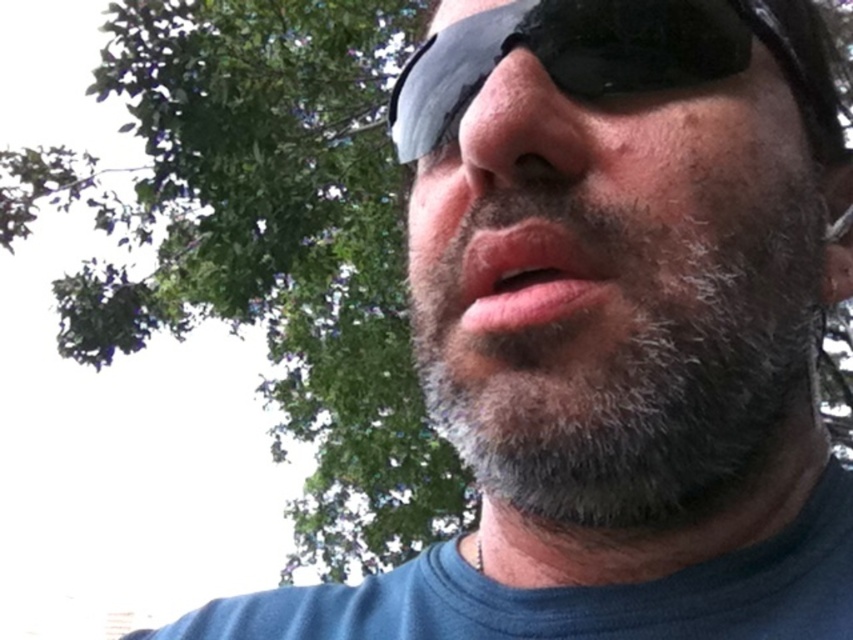
Is gray fuzzy beard at center to the right of dry matte nose at center from the viewer's perspective?

Indeed, gray fuzzy beard at center is positioned on the right side of dry matte nose at center.

Measure the distance between point (747, 477) and camera.

The distance of point (747, 477) from camera is 19.16 inches.

Find the location of `gray fuzzy beard at center`. gray fuzzy beard at center is located at coordinates (618, 349).

Can you confirm if gray fuzzy beard at center is positioned to the left of pink matte lips at center?

Incorrect, gray fuzzy beard at center is not on the left side of pink matte lips at center.

Does gray fuzzy beard at center appear over pink matte lips at center?

Yes, gray fuzzy beard at center is above pink matte lips at center.

Which is in front, point (468, 285) or point (476, 292)?

Point (476, 292) is in front.

The image size is (853, 640). Identify the location of gray fuzzy beard at center. (618, 349).

Can you confirm if dry matte nose at center is bigger than pink matte lips at center?

Yes.

Describe the element at coordinates (520, 131) in the screenshot. I see `dry matte nose at center` at that location.

I want to click on dry matte nose at center, so click(x=520, y=131).

This screenshot has height=640, width=853. I want to click on dry matte nose at center, so click(x=520, y=131).